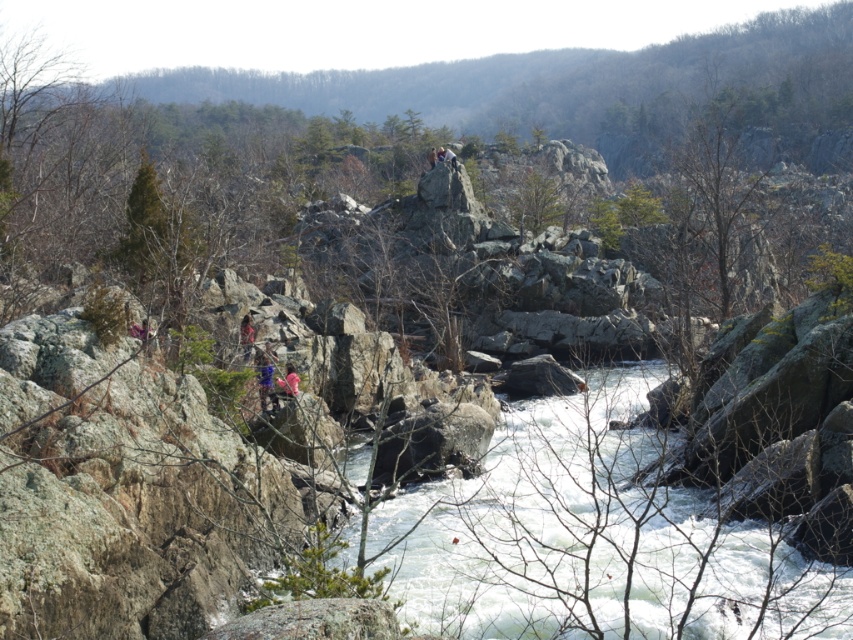
Question: Estimate the real-world distances between objects in this image. Which object is closer to the white frothy water at center?

Choices:
 (A) blue fabric person at center
 (B) matte pink shirt at center

Answer: (B)

Question: Which of the following is the farthest from the observer?

Choices:
 (A) (294, 394)
 (B) (267, 378)
 (C) (564, 536)

Answer: (B)

Question: Which object is the closest to the matte pink shirt at center?

Choices:
 (A) blue fabric person at center
 (B) white frothy water at center
 (C) pink fabric at center

Answer: (A)

Question: Is white frothy water at center thinner than blue fabric person at center?

Choices:
 (A) yes
 (B) no

Answer: (B)

Question: Can you confirm if white frothy water at center is positioned to the left of pink fabric at center?

Choices:
 (A) yes
 (B) no

Answer: (B)

Question: Is white frothy water at center smaller than matte pink shirt at center?

Choices:
 (A) no
 (B) yes

Answer: (A)